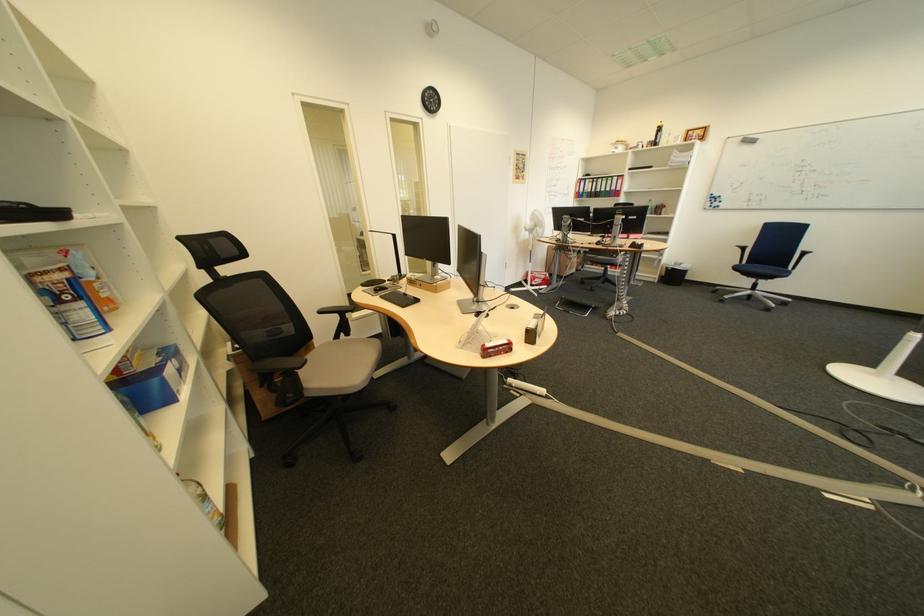
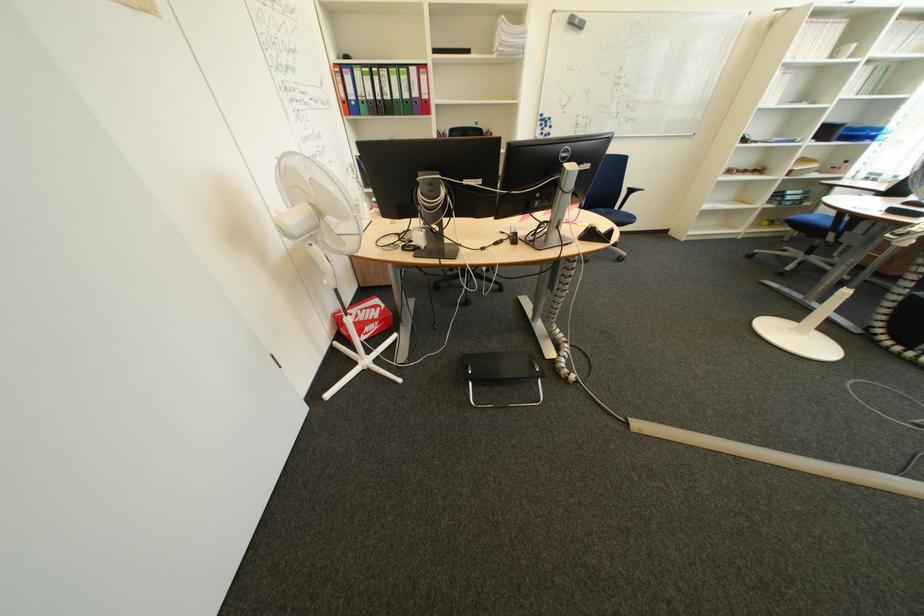
Locate, in the second image, the point that corresponds to pixel 591 220 in the first image.

(479, 184)